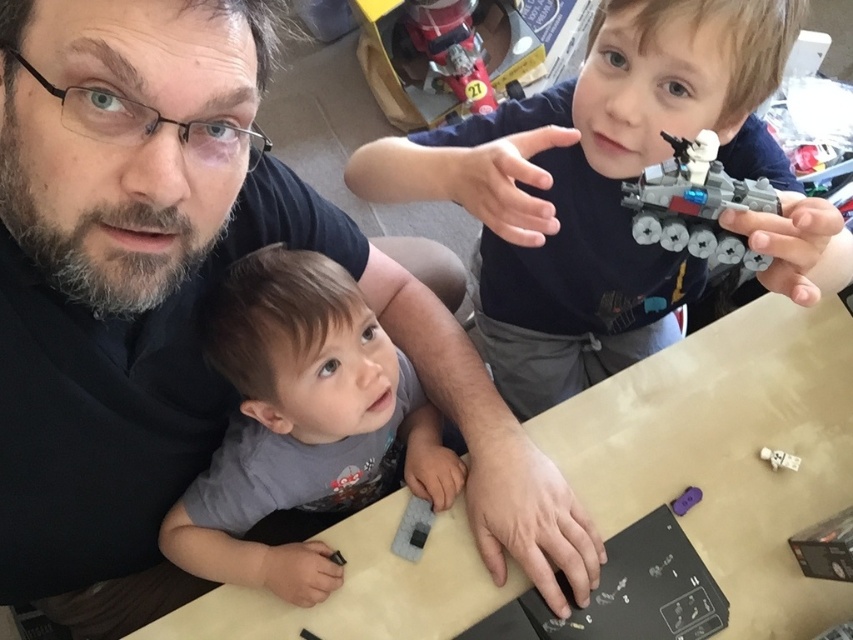
You are a toy organizer who needs to place the shiny plastic spaceship at upper right and the metallic red firetruck at upper center into storage boxes. The spaceship box can only accommodate items wider than the firetruck. Will the spaceship fit in its designated box?

The shiny plastic spaceship at upper right is wider than the metallic red firetruck at upper center, so it will fit in the box designed for wider items.